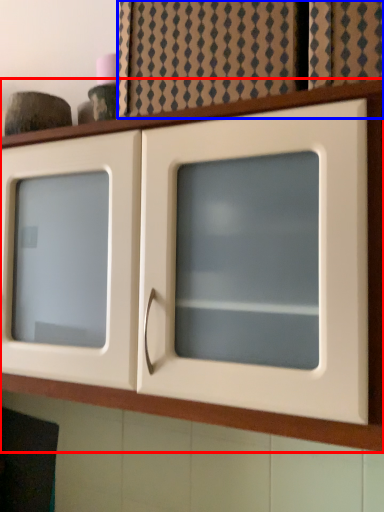
Question: Which object is further to the camera taking this photo, cupboard (highlighted by a red box) or curtain (highlighted by a blue box)?

Choices:
 (A) cupboard
 (B) curtain

Answer: (B)